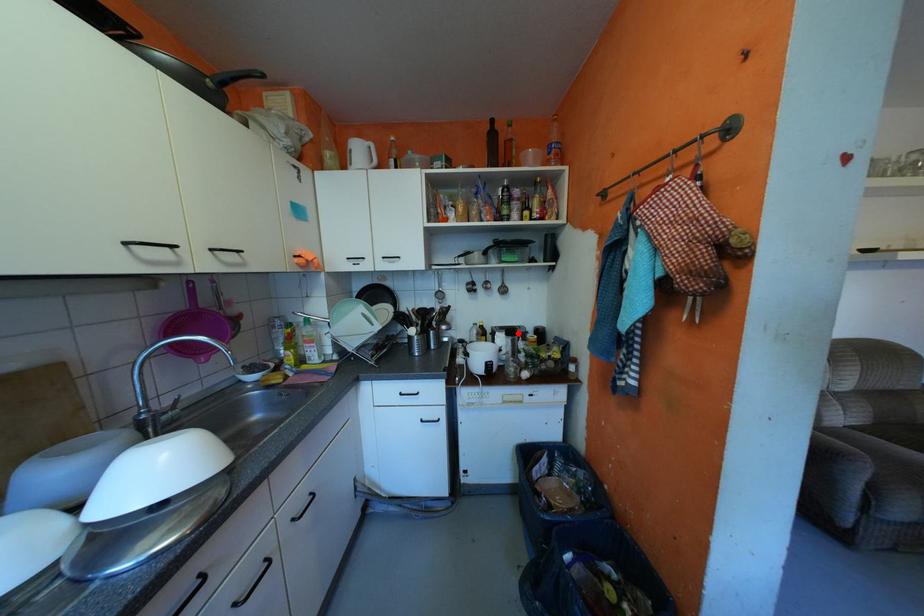
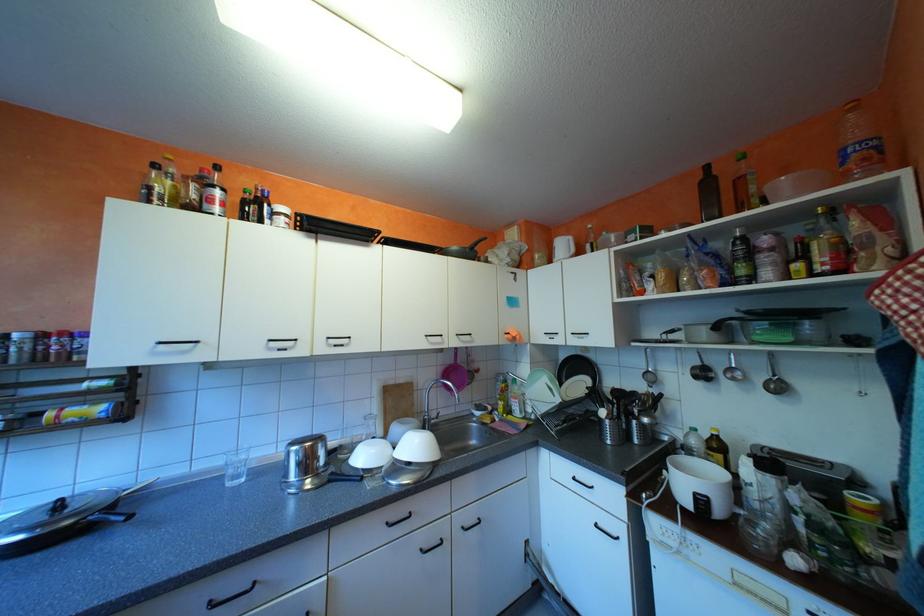
The point at the highlighted location is marked in the first image. Where is the corresponding point in the second image?

(771, 464)